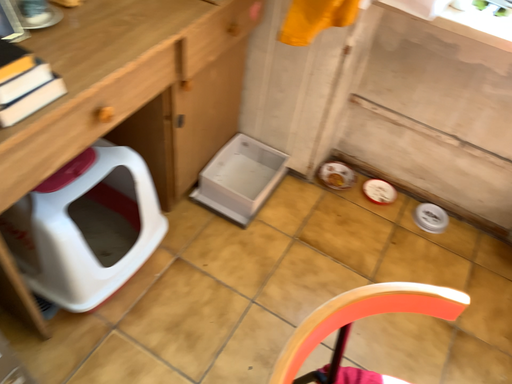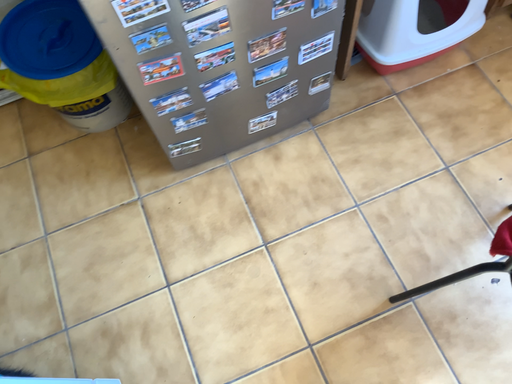
Question: How did the camera likely rotate when shooting the video?

Choices:
 (A) rotated upward
 (B) rotated downward

Answer: (B)